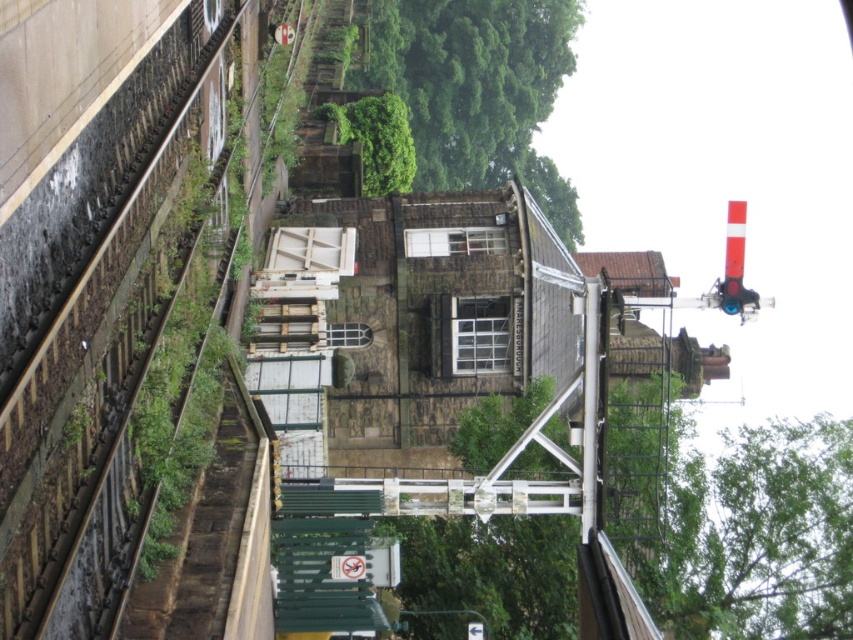
Question: Does green leafy tree at upper center appear under green leafy tree at center?

Choices:
 (A) yes
 (B) no

Answer: (B)

Question: Is brown stone train track at left bigger than green leafy tree at upper center?

Choices:
 (A) yes
 (B) no

Answer: (B)

Question: Which of these objects is positioned farthest from the green leafy tree at upper center?

Choices:
 (A) green leafy tree at center
 (B) brown stone train track at left

Answer: (B)

Question: Which is farther from the green leafy tree at center?

Choices:
 (A) green leafy tree at upper center
 (B) brown stone train track at left

Answer: (B)

Question: In this image, where is brown stone train track at left located relative to green leafy tree at upper center?

Choices:
 (A) above
 (B) below

Answer: (B)

Question: Which object is positioned closest to the green leafy tree at upper center?

Choices:
 (A) green leafy tree at center
 (B) brown stone train track at left

Answer: (A)